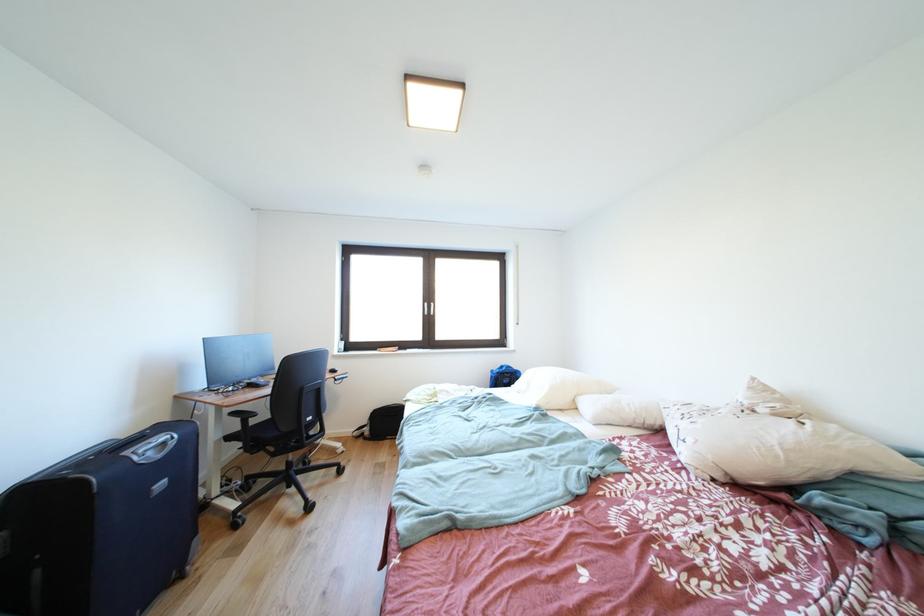
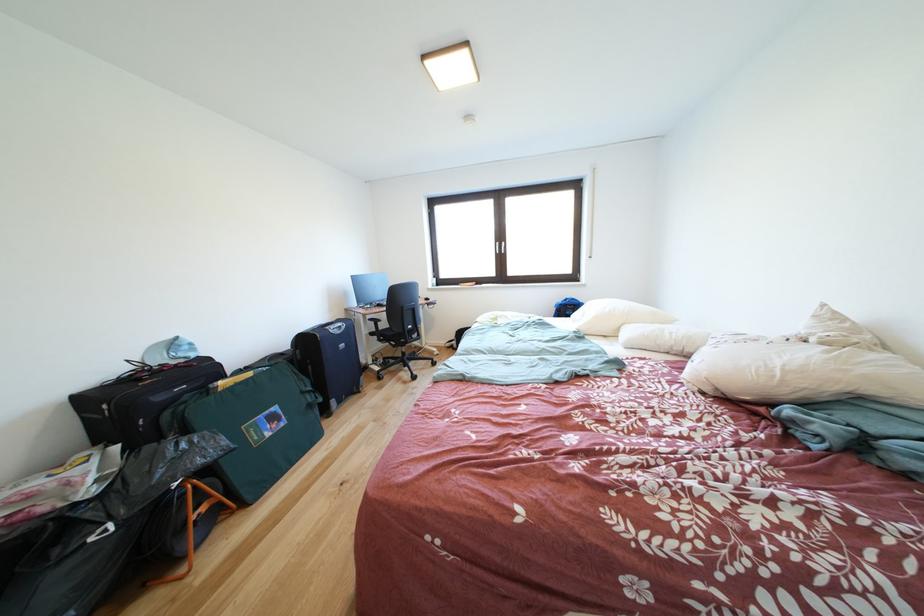
Locate, in the second image, the point that corresponds to (237,442) in the first image.

(380, 339)